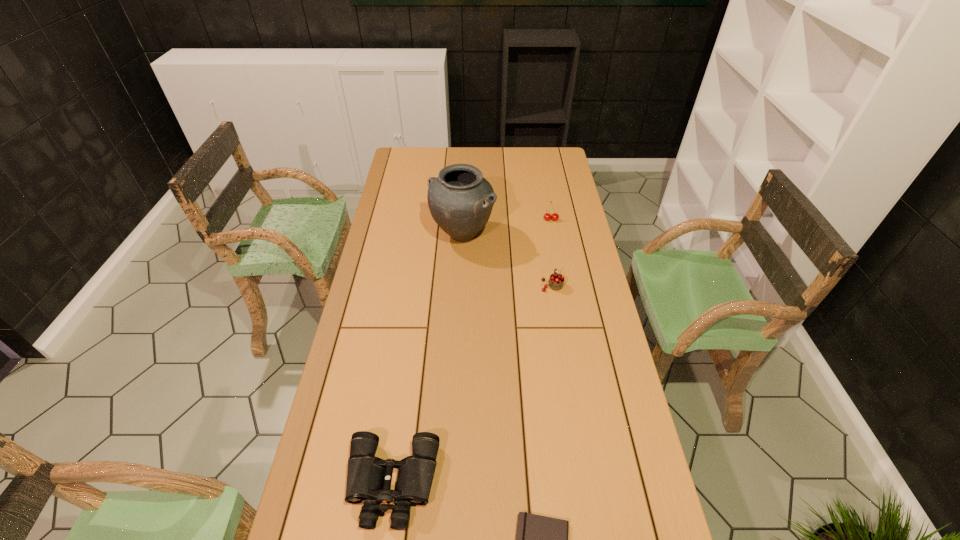
Where is `the second closest object to the third farthest object`? The height and width of the screenshot is (540, 960). the second closest object to the third farthest object is located at coordinates (547, 216).

Identify the location of object that stands as the second closest to the farther cherry. The image size is (960, 540). (556, 281).